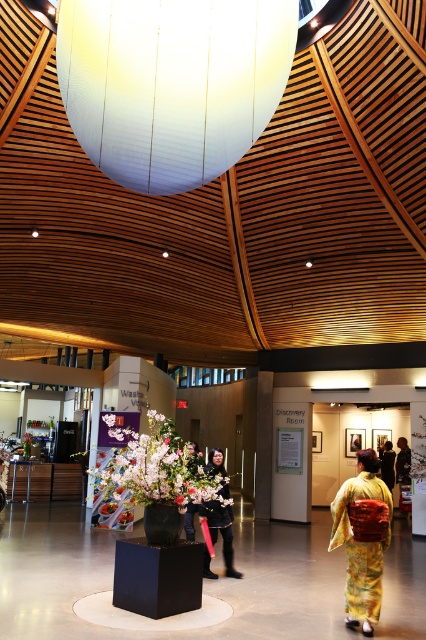
What do you see at coordinates (362, 538) in the screenshot? This screenshot has height=640, width=426. I see `yellow silk kimono at center` at bounding box center [362, 538].

At what (x,y) coordinates should I click in order to perform the action: click on yellow silk kimono at center. Please return your answer as a coordinate pair (x, y). The width and height of the screenshot is (426, 640). Looking at the image, I should click on (362, 538).

What are the coordinates of `yellow silk kimono at center` in the screenshot? It's located at (362, 538).

Is floral arrangement at center taller than black fabric jacket at center?

Incorrect, floral arrangement at center's height is not larger of black fabric jacket at center's.

This screenshot has height=640, width=426. I want to click on floral arrangement at center, so click(x=154, y=468).

Does black fabric jacket at center have a smaller size compared to silky kimono at center?

Yes.

Is black fabric jacket at center to the right of silky kimono at center from the viewer's perspective?

Indeed, black fabric jacket at center is positioned on the right side of silky kimono at center.

At what (x,y) coordinates should I click in order to perform the action: click on black fabric jacket at center. Please return your answer as a coordinate pair (x, y). Looking at the image, I should click on (221, 531).

Locate an element on the screen. The width and height of the screenshot is (426, 640). black fabric jacket at center is located at coordinates (221, 531).